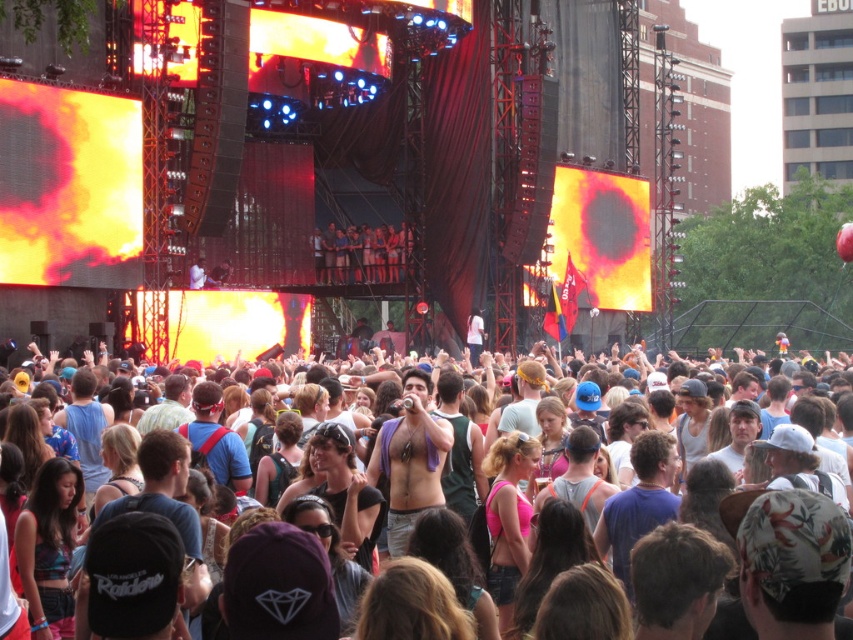
Is multicolored casual attire at center smaller than matte black camera at upper center?

No, multicolored casual attire at center is not smaller than matte black camera at upper center.

Does multicolored casual attire at center have a lesser width compared to matte black camera at upper center?

No.

Between point (572, 445) and point (387, 227), which one is positioned behind?

The point (387, 227) is more distant.

Identify the location of multicolored casual attire at center. This screenshot has width=853, height=640. (677, 476).